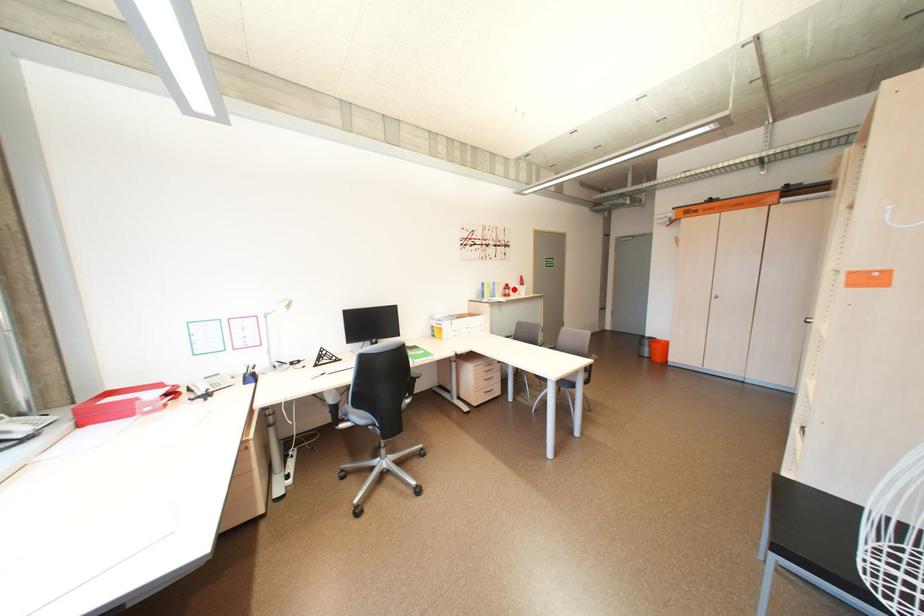
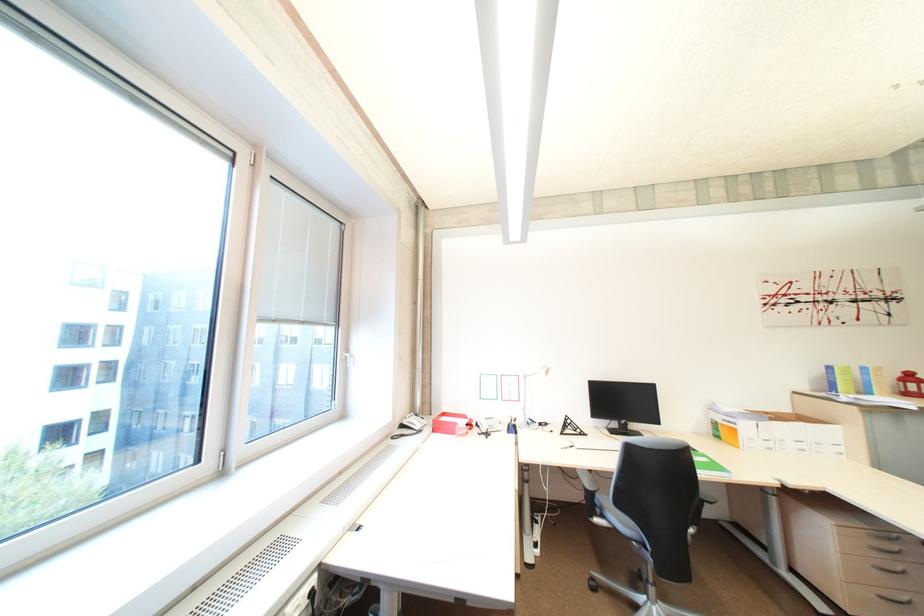
The point at the highlighted location is marked in the first image. Where is the corresponding point in the second image?

(913, 382)